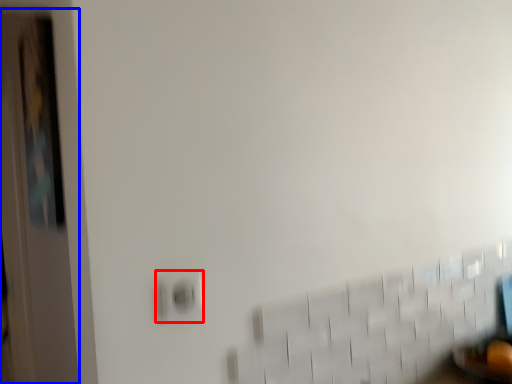
Question: Which of the following is the farthest to the observer, electric outlet (highlighted by a red box) or door (highlighted by a blue box)?

Choices:
 (A) electric outlet
 (B) door

Answer: (B)